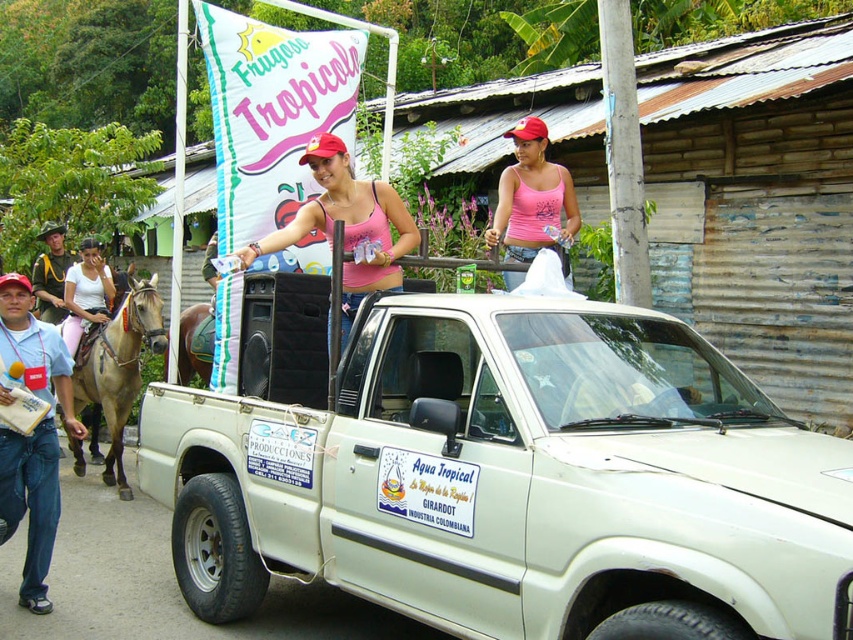
You are a photographer at the event and need to capture both the blue denim jeans at lower left and the pink tank top at upper center in the same frame. Which direction should you move your camera to ensure both are visible?

To include both the blue denim jeans at lower left and the pink tank top at upper center in the frame, move the camera to the right since the blue denim jeans at lower left is positioned on the left side of the pink tank top at upper center.

You are a photographer at the event and want to capture both the pink fabric bikini top at center and the pink tank top at upper center in a single shot. Which one will appear larger in the photo?

The pink fabric bikini top at center will appear larger in the photo since it has a greater height compared to the pink tank top at upper center.